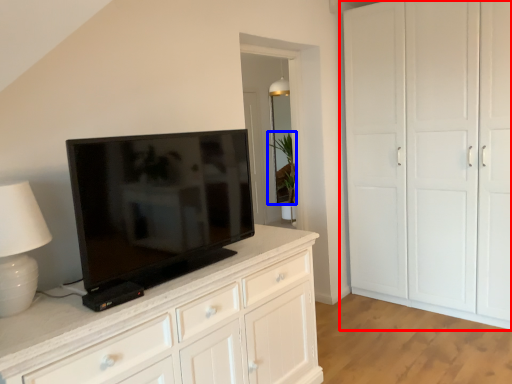
Question: Among these objects, which one is farthest to the camera, cupboard (highlighted by a red box) or plant (highlighted by a blue box)?

Choices:
 (A) cupboard
 (B) plant

Answer: (B)